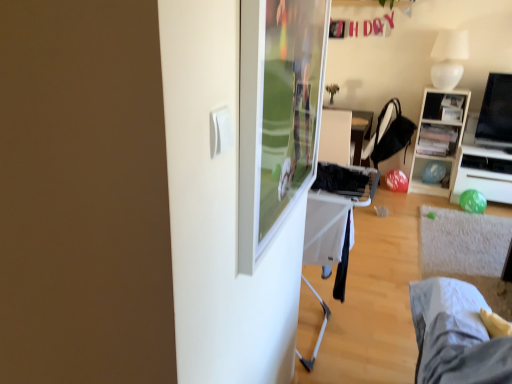
What is the approximate width of black fabric chair at center?

15.15 inches.

What do you see at coordinates (449, 58) in the screenshot?
I see `white glossy lamp at upper right` at bounding box center [449, 58].

I want to click on white glossy lamp at upper right, so click(x=449, y=58).

From the picture: What is the approximate width of black plastic table at center?

24.78 inches.

Where is `black plastic table at center`? The height and width of the screenshot is (384, 512). black plastic table at center is located at coordinates (342, 135).

This screenshot has height=384, width=512. I want to click on green matte desk at right, so click(482, 174).

Find the location of `white fabric bed at lower right`. white fabric bed at lower right is located at coordinates (455, 335).

Considering the sizes of objects wooden shelf at right and black fabric chair at center in the image provided, who is smaller, wooden shelf at right or black fabric chair at center?

With smaller size is black fabric chair at center.

In the image, is wooden shelf at right on the left side or the right side of black fabric chair at center?

wooden shelf at right is to the right of black fabric chair at center.

In the scene shown: Is wooden shelf at right further to camera compared to black fabric chair at center?

Yes, it is.

From a real-world perspective, who is located lower, wooden shelf at upper right or wooden shelf at right?

wooden shelf at right, from a real-world perspective.

This screenshot has height=384, width=512. I want to click on cabinetry that is below the wooden shelf at upper right (from the image's perspective), so click(x=438, y=137).

Is wooden shelf at upper right taller than wooden shelf at right?

Incorrect, the height of wooden shelf at upper right is not larger of that of wooden shelf at right.

Is wooden shelf at upper right next to wooden shelf at right?

No, wooden shelf at upper right is not with wooden shelf at right.

From a real-world perspective, is white glossy lamp at upper right positioned under wooden shelf at right based on gravity?

No, from a real-world perspective, white glossy lamp at upper right is not beneath wooden shelf at right.

In terms of height, does white glossy lamp at upper right look taller or shorter compared to wooden shelf at right?

Considering their sizes, white glossy lamp at upper right has less height than wooden shelf at right.

Consider the image. From the image's perspective, does white glossy lamp at upper right appear lower than wooden shelf at right?

Actually, white glossy lamp at upper right appears above wooden shelf at right in the image.

You are a GUI agent. You are given a task and a screenshot of the screen. Output one action in this format:
    pyautogui.click(x=<x>, y=<y>)
    Task: Click on the cabinetry below the white glossy lamp at upper right (from a real-world perspective)
    This screenshot has width=512, height=384.
    Given the screenshot: What is the action you would take?
    pyautogui.click(x=438, y=137)

Is black glossy tv at right looking in the opposite direction of white glossy lamp at upper right?

No, white glossy lamp at upper right is not at the back of black glossy tv at right.

Which object is thinner, black glossy tv at right or white glossy lamp at upper right?

black glossy tv at right.

Is black glossy tv at right with white glossy lamp at upper right?

No, black glossy tv at right is not next to white glossy lamp at upper right.

Measure the distance between black glossy tv at right and white glossy lamp at upper right.

17.96 inches.

From the picture: Does white fabric bed at lower right have a greater height compared to wooden shelf at upper right?

Correct, white fabric bed at lower right is much taller as wooden shelf at upper right.

Can you confirm if white fabric bed at lower right is bigger than wooden shelf at upper right?

Correct, white fabric bed at lower right is larger in size than wooden shelf at upper right.

Which object is closer to the camera taking this photo, white fabric bed at lower right or wooden shelf at upper right?

Positioned in front is white fabric bed at lower right.

Is white glossy lamp at upper right looking in the opposite direction of black glossy tv at right?

No, white glossy lamp at upper right is not facing away from black glossy tv at right.

Which object is further away from the camera taking this photo, white glossy lamp at upper right or black glossy tv at right?

white glossy lamp at upper right is further away from the camera.

Can you confirm if white glossy lamp at upper right is positioned to the right of black glossy tv at right?

No.

Can you confirm if white glossy lamp at upper right is wider than black glossy tv at right?

Correct, the width of white glossy lamp at upper right exceeds that of black glossy tv at right.

You are a GUI agent. You are given a task and a screenshot of the screen. Output one action in this format:
    pyautogui.click(x=<x>, y=<y>)
    Task: Click on the lamp on the left of wooden shelf at upper right
    This screenshot has width=512, height=384.
    Given the screenshot: What is the action you would take?
    pyautogui.click(x=449, y=58)

Is wooden shelf at upper right spatially inside white glossy lamp at upper right, or outside of it?

wooden shelf at upper right is not enclosed by white glossy lamp at upper right.

From the image's perspective, would you say wooden shelf at upper right is shown under white glossy lamp at upper right?

Yes, from the image's perspective, wooden shelf at upper right is beneath white glossy lamp at upper right.

Is wooden shelf at upper right facing away from white glossy lamp at upper right?

No, wooden shelf at upper right is not facing away from white glossy lamp at upper right.

In the image, there is a black fabric chair at center. In order to click on cabinetry below it (from a real-world perspective) in this screenshot , I will do (438, 137).

Image resolution: width=512 pixels, height=384 pixels. Find the location of `shelf above the wooden shelf at right (from a real-world perspective)`. shelf above the wooden shelf at right (from a real-world perspective) is located at coordinates (437, 140).

Which object lies further to the anchor point black plastic table at center, black fabric chair at center or white glossy lamp at upper right?

The object further to black plastic table at center is white glossy lamp at upper right.

Based on their spatial positions, is wooden shelf at right or white glossy lamp at upper right further from black glossy tv at right?

white glossy lamp at upper right is positioned further to the anchor black glossy tv at right.

From the image, which object appears to be nearer to wooden shelf at right, black glossy tv at right or green matte desk at right?

Based on the image, green matte desk at right appears to be nearer to wooden shelf at right.

Looking at the image, which one is located further to wooden shelf at right, black glossy tv at right or black fabric chair at center?

The object further to wooden shelf at right is black glossy tv at right.

Estimate the real-world distances between objects in this image. Which object is closer to black fabric chair at center, green matte desk at right or white fabric bed at lower right?

green matte desk at right.

From the image, which object appears to be nearer to white fabric bed at lower right, black glossy tv at right or black fabric chair at center?

black fabric chair at center is positioned closer to the anchor white fabric bed at lower right.

Based on the photo, estimate the real-world distances between objects in this image. Which object is closer to white fabric bed at lower right, wooden shelf at right or black fabric chair at center?

Based on the image, black fabric chair at center appears to be nearer to white fabric bed at lower right.

Which object lies nearer to the anchor point wooden shelf at upper right, black glossy tv at right or black plastic table at center?

Based on the image, black glossy tv at right appears to be nearer to wooden shelf at upper right.

Where is `shelf located between black plastic table at center and black glossy tv at right in the left-right direction`? shelf located between black plastic table at center and black glossy tv at right in the left-right direction is located at coordinates (437, 140).

I want to click on television between white glossy lamp at upper right and wooden shelf at right in the up-down direction, so click(496, 113).

In order to click on desk between white fabric bed at lower right and wooden shelf at right along the z-axis in this screenshot , I will do `click(482, 174)`.

This screenshot has height=384, width=512. In order to click on chair positioned between white fabric bed at lower right and wooden shelf at right from near to far in this screenshot , I will do `click(391, 135)`.